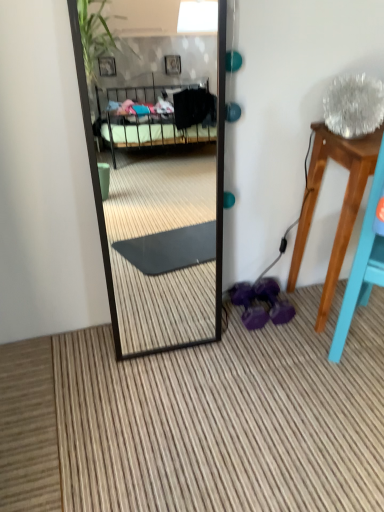
What do you see at coordinates (342, 204) in the screenshot?
I see `wooden stool at right` at bounding box center [342, 204].

Identify the location of wooden stool at right. The width and height of the screenshot is (384, 512). (342, 204).

What is the approximate height of wooden stool at right?

wooden stool at right is 29.70 inches tall.

The image size is (384, 512). I want to click on purple rubber dumbbells at lower center, so click(x=248, y=305).

Describe the element at coordinates (248, 305) in the screenshot. Image resolution: width=384 pixels, height=512 pixels. I see `purple rubber dumbbells at lower center` at that location.

Find the location of a particular element. wooden stool at right is located at coordinates (342, 204).

Considering the relative positions of wooden stool at right and purple rubber dumbbells at lower center in the image provided, is wooden stool at right to the right of purple rubber dumbbells at lower center from the viewer's perspective?

Correct, you'll find wooden stool at right to the right of purple rubber dumbbells at lower center.

Who is more distant, wooden stool at right or purple rubber dumbbells at lower center?

purple rubber dumbbells at lower center is further away from the camera.

Is point (340, 240) farther from camera compared to point (245, 292)?

That is False.

From the image's perspective, is wooden stool at right on top of purple rubber dumbbells at lower center?

Yes.

From a real-world perspective, is wooden stool at right physically located above or below purple rubber dumbbells at lower center?

wooden stool at right is above purple rubber dumbbells at lower center.

Does wooden stool at right have a lesser width compared to purple rubber dumbbells at lower center?

Incorrect, the width of wooden stool at right is not less than that of purple rubber dumbbells at lower center.

Between wooden stool at right and purple rubber dumbbells at lower center, which one has more height?

Standing taller between the two is wooden stool at right.

Can you confirm if wooden stool at right is smaller than purple rubber dumbbells at lower center?

No, wooden stool at right is not smaller than purple rubber dumbbells at lower center.

Is wooden stool at right located outside purple rubber dumbbells at lower center?

Yes, wooden stool at right is located beyond the bounds of purple rubber dumbbells at lower center.

Is wooden stool at right not near purple rubber dumbbells at lower center?

Actually, wooden stool at right and purple rubber dumbbells at lower center are a little close together.

Is wooden stool at right turned away from purple rubber dumbbells at lower center?

No.

Image resolution: width=384 pixels, height=512 pixels. Find the location of `table above the purple rubber dumbbells at lower center (from the image's perspective)`. table above the purple rubber dumbbells at lower center (from the image's perspective) is located at coordinates (342, 204).

Considering the relative positions of purple rubber dumbbells at lower center and wooden stool at right in the image provided, is purple rubber dumbbells at lower center to the right of wooden stool at right from the viewer's perspective?

No.

From the picture: Which object is closer to the camera, purple rubber dumbbells at lower center or wooden stool at right?

Positioned in front is wooden stool at right.

Which is in front, point (245, 309) or point (355, 202)?

The point (355, 202) is more forward.

From the image's perspective, is purple rubber dumbbells at lower center located above or below wooden stool at right?

purple rubber dumbbells at lower center is situated lower than wooden stool at right in the image.

From a real-world perspective, is purple rubber dumbbells at lower center positioned over wooden stool at right based on gravity?

Incorrect, from a real-world perspective, purple rubber dumbbells at lower center is lower than wooden stool at right.

Which of these two, purple rubber dumbbells at lower center or wooden stool at right, is thinner?

Thinner between the two is purple rubber dumbbells at lower center.

Between purple rubber dumbbells at lower center and wooden stool at right, which one has more height?

Standing taller between the two is wooden stool at right.

Considering the sizes of objects purple rubber dumbbells at lower center and wooden stool at right in the image provided, who is bigger, purple rubber dumbbells at lower center or wooden stool at right?

wooden stool at right.

In the scene shown: Which is correct: purple rubber dumbbells at lower center is inside wooden stool at right, or outside of it?

purple rubber dumbbells at lower center is located beyond the bounds of wooden stool at right.

Would you say purple rubber dumbbells at lower center is a long distance from wooden stool at right?

No, purple rubber dumbbells at lower center is not far from wooden stool at right.

Is purple rubber dumbbells at lower center facing away from wooden stool at right?

No, wooden stool at right is not at the back of purple rubber dumbbells at lower center.

What's the angular difference between purple rubber dumbbells at lower center and wooden stool at right's facing directions?

They differ by 4.01 degrees in their facing directions.

Where is `table on the right of purple rubber dumbbells at lower center`? This screenshot has height=512, width=384. table on the right of purple rubber dumbbells at lower center is located at coordinates (342, 204).

Image resolution: width=384 pixels, height=512 pixels. In order to click on table lying in front of the purple rubber dumbbells at lower center in this screenshot , I will do pyautogui.click(x=342, y=204).

The width and height of the screenshot is (384, 512). I want to click on table that appears on the right of purple rubber dumbbells at lower center, so click(x=342, y=204).